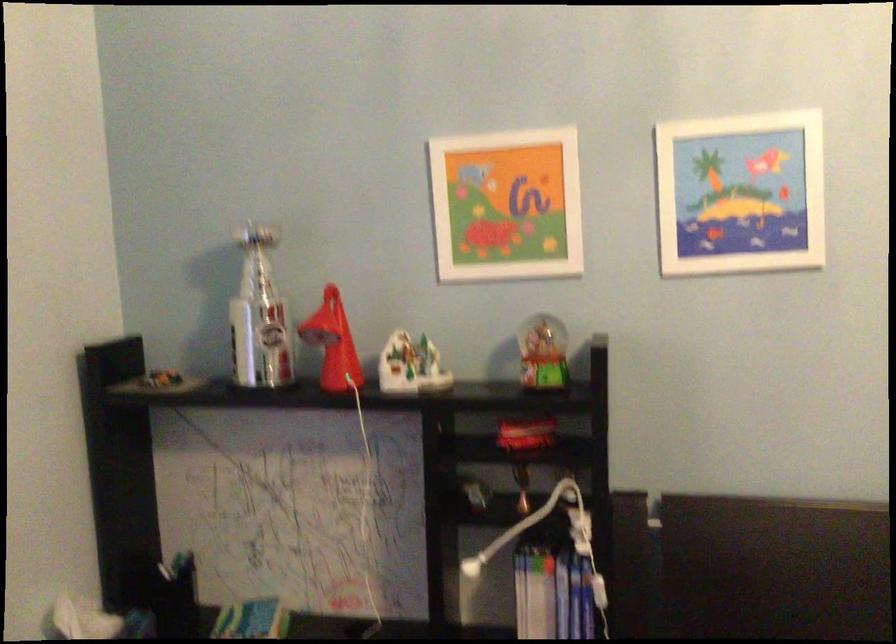
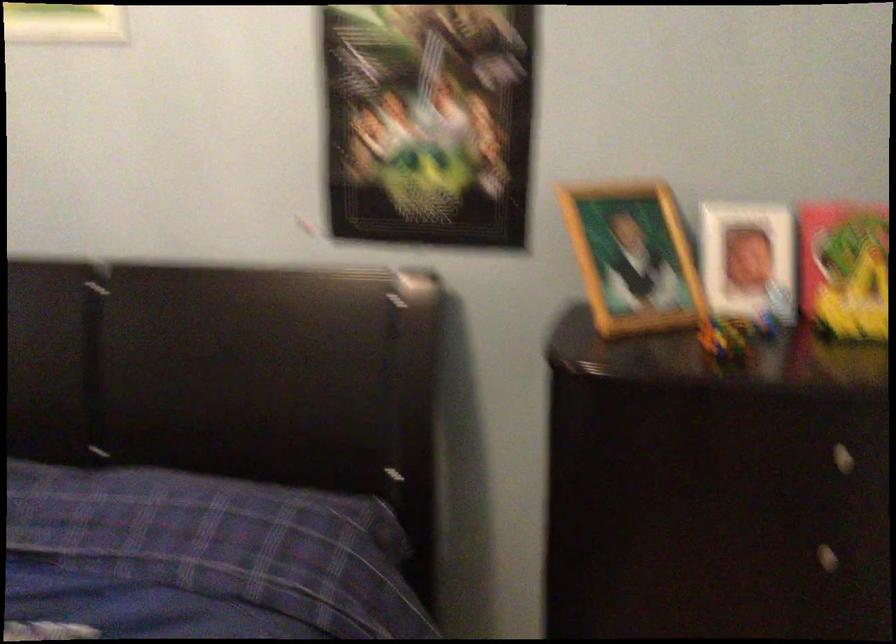
Question: Which direction would the cameraman need to move to produce the second image? Reply with the corresponding letter.

Choices:
 (A) Left
 (B) Right
 (C) Forward
 (D) Backward

Answer: (B)